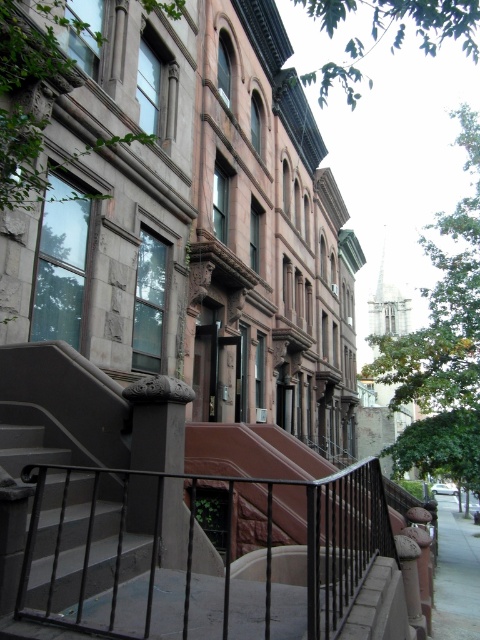
Question: From the image, what is the correct spatial relationship of dark gray concrete stairs at lower left in relation to gray concrete sidewalk at lower right?

Choices:
 (A) above
 (B) below

Answer: (A)

Question: Can you confirm if dark gray concrete stairs at lower left is positioned below gray concrete sidewalk at lower right?

Choices:
 (A) yes
 (B) no

Answer: (B)

Question: Which point is closer to the camera taking this photo?

Choices:
 (A) (81, 534)
 (B) (255, 628)

Answer: (B)

Question: Considering the relative positions of dark gray concrete stairs at lower left and gray concrete sidewalk at lower right in the image provided, where is dark gray concrete stairs at lower left located with respect to gray concrete sidewalk at lower right?

Choices:
 (A) above
 (B) below

Answer: (A)

Question: Considering the real-world distances, which object is farthest from the gray concrete sidewalk at lower right?

Choices:
 (A) black wrought iron at lower center
 (B) dark gray concrete stairs at lower left

Answer: (B)

Question: Which point is farther to the camera?

Choices:
 (A) black wrought iron at lower center
 (B) dark gray concrete stairs at lower left
 (C) gray concrete sidewalk at lower right

Answer: (C)